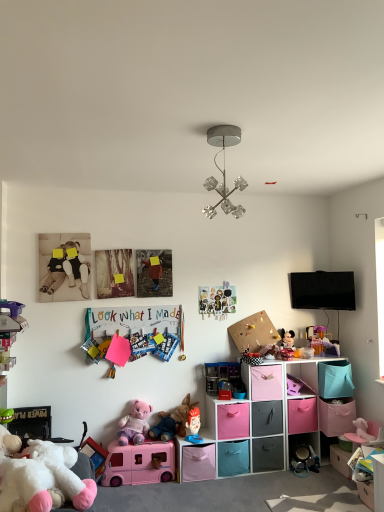
Question: From a real-world perspective, is clear glass chandelier at upper center positioned under matte plastic toy at center, arranged as the 6th toy when viewed from the back, based on gravity?

Choices:
 (A) yes
 (B) no

Answer: (B)

Question: Is clear glass chandelier at upper center in front of matte plastic toy at center, arranged as the 6th toy when viewed from the back?

Choices:
 (A) no
 (B) yes

Answer: (B)

Question: Does clear glass chandelier at upper center have a greater height compared to matte plastic toy at center, arranged as the 6th toy when viewed from the back?

Choices:
 (A) no
 (B) yes

Answer: (B)

Question: Is matte plastic toy at center, arranged as the 6th toy when viewed from the back, located within clear glass chandelier at upper center?

Choices:
 (A) no
 (B) yes

Answer: (A)

Question: Considering the relative sizes of clear glass chandelier at upper center and matte plastic toy at center, which appears as the sixth toy when viewed from the front, in the image provided, is clear glass chandelier at upper center wider than matte plastic toy at center, which appears as the sixth toy when viewed from the front,?

Choices:
 (A) no
 (B) yes

Answer: (B)

Question: From the image's perspective, does clear glass chandelier at upper center appear higher than matte plastic toy at center, arranged as the 6th toy when viewed from the back?

Choices:
 (A) no
 (B) yes

Answer: (B)

Question: Is pastel fabric storage cubes at center aimed at clear glass chandelier at upper center?

Choices:
 (A) yes
 (B) no

Answer: (B)

Question: From the image's perspective, is pastel fabric storage cubes at center over clear glass chandelier at upper center?

Choices:
 (A) yes
 (B) no

Answer: (B)

Question: Is clear glass chandelier at upper center surrounded by pastel fabric storage cubes at center?

Choices:
 (A) no
 (B) yes

Answer: (A)

Question: Would you say pastel fabric storage cubes at center is outside clear glass chandelier at upper center?

Choices:
 (A) no
 (B) yes

Answer: (B)

Question: Can you confirm if pastel fabric storage cubes at center is thinner than clear glass chandelier at upper center?

Choices:
 (A) no
 (B) yes

Answer: (A)

Question: Considering the relative sizes of pastel fabric storage cubes at center and clear glass chandelier at upper center in the image provided, is pastel fabric storage cubes at center wider than clear glass chandelier at upper center?

Choices:
 (A) no
 (B) yes

Answer: (B)

Question: Is pastel fabric storage cubes at center located within matte plastic toy at center, arranged as the 6th toy when viewed from the back?

Choices:
 (A) no
 (B) yes

Answer: (A)